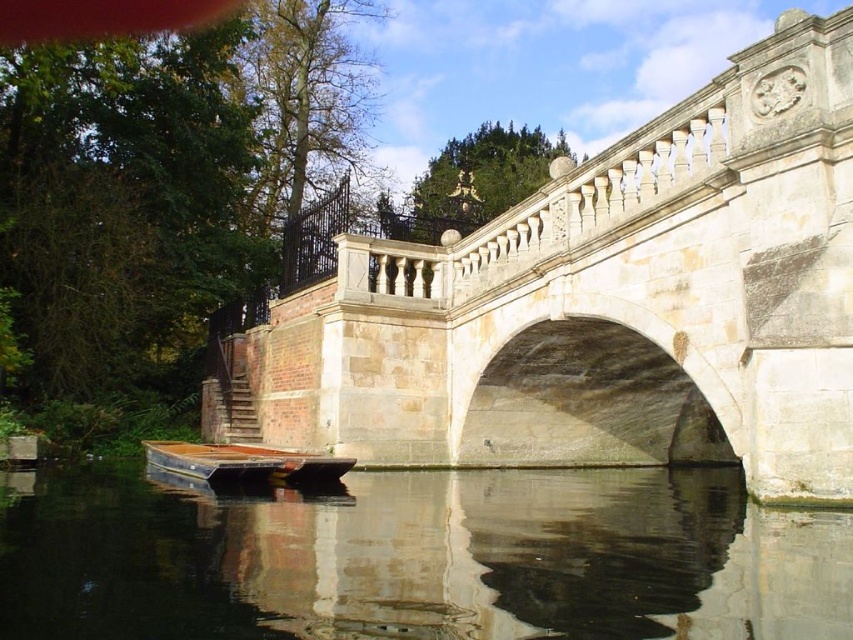
Question: Does smooth dark water at center appear on the right side of wooden dock at lower center?

Choices:
 (A) no
 (B) yes

Answer: (B)

Question: Is smooth dark water at center wider than wooden dock at lower center?

Choices:
 (A) yes
 (B) no

Answer: (A)

Question: Estimate the real-world distances between objects in this image. Which object is closer to the stone bridge at center?

Choices:
 (A) smooth dark water at center
 (B) wooden dock at lower center

Answer: (A)

Question: Is smooth dark water at center below wooden dock at lower center?

Choices:
 (A) yes
 (B) no

Answer: (A)

Question: Which of these objects is positioned closest to the stone bridge at center?

Choices:
 (A) wooden dock at lower center
 (B) smooth dark water at center

Answer: (B)

Question: Which point appears closest to the camera in this image?

Choices:
 (A) (221, 480)
 (B) (202, 557)

Answer: (B)